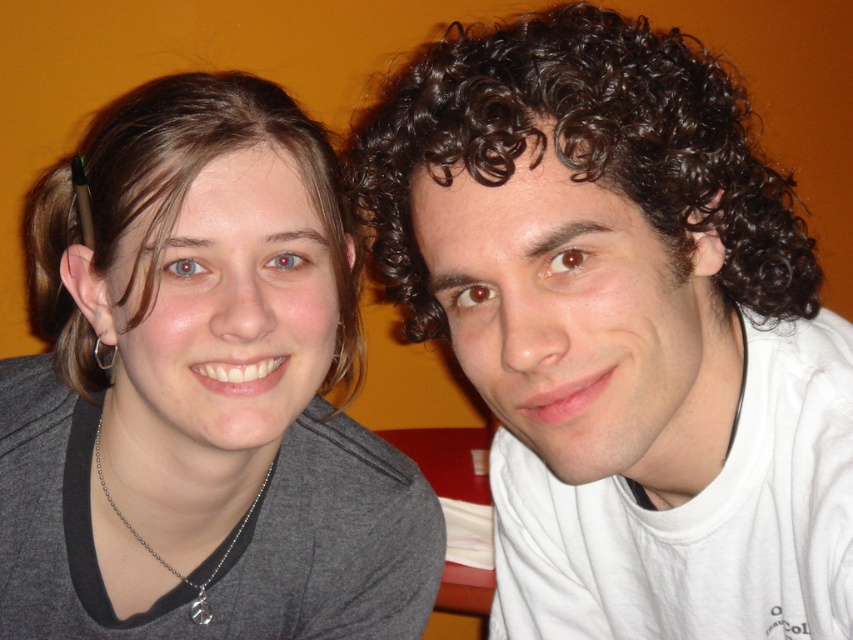
Is gray fabric at left smaller than brown smooth hair at left?

Actually, gray fabric at left might be larger than brown smooth hair at left.

Who is more forward, (170, 106) or (93, 381)?

Point (170, 106) is more forward.

Where is `gray fabric at left`? The image size is (853, 640). gray fabric at left is located at coordinates (201, 392).

Is dark brown curly hair at center taller than gray fabric at left?

Yes, dark brown curly hair at center is taller than gray fabric at left.

Which is more to the left, dark brown curly hair at center or gray fabric at left?

From the viewer's perspective, gray fabric at left appears more on the left side.

Is point (598, 76) positioned behind point (144, 397)?

No, (598, 76) is closer to viewer.

This screenshot has height=640, width=853. I want to click on dark brown curly hair at center, so click(622, 326).

Who is positioned more to the right, dark brown curly hair at center or brown smooth hair at left?

dark brown curly hair at center is more to the right.

The width and height of the screenshot is (853, 640). Describe the element at coordinates (622, 326) in the screenshot. I see `dark brown curly hair at center` at that location.

Between point (585, 412) and point (161, 115), which one is positioned in front?

Positioned in front is point (585, 412).

I want to click on dark brown curly hair at center, so click(622, 326).